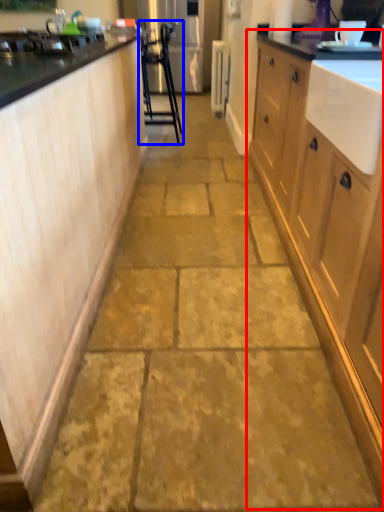
Question: Which object appears farthest to the camera in this image, cabinetry (highlighted by a red box) or furniture (highlighted by a blue box)?

Choices:
 (A) cabinetry
 (B) furniture

Answer: (B)